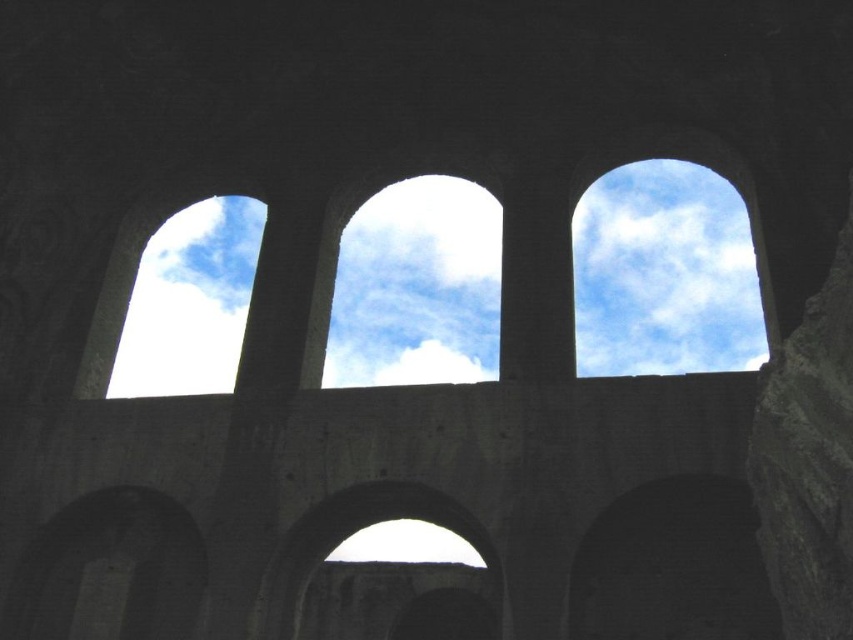
Question: Is blue sky at upper right thinner than dark stone archway at center?

Choices:
 (A) no
 (B) yes

Answer: (A)

Question: Can you confirm if blue sky at upper right is wider than dark gray stone archway at lower left?

Choices:
 (A) yes
 (B) no

Answer: (A)

Question: Which of the following is the farthest from the observer?

Choices:
 (A) (273, 577)
 (B) (492, 211)
 (C) (648, 324)
 (D) (83, 536)

Answer: (C)

Question: Observing the image, what is the correct spatial positioning of white fluffy cloud at upper center in reference to blue sky at upper right?

Choices:
 (A) left
 (B) right

Answer: (A)

Question: Which point is farther to the camera?

Choices:
 (A) dark gray stone archway at lower left
 (B) blue sky at upper right

Answer: (B)

Question: Which object is the closest to the dark gray stone archway at lower left?

Choices:
 (A) blue sky at upper right
 (B) dark stone archway at center
 (C) white fluffy cloud at upper center

Answer: (B)